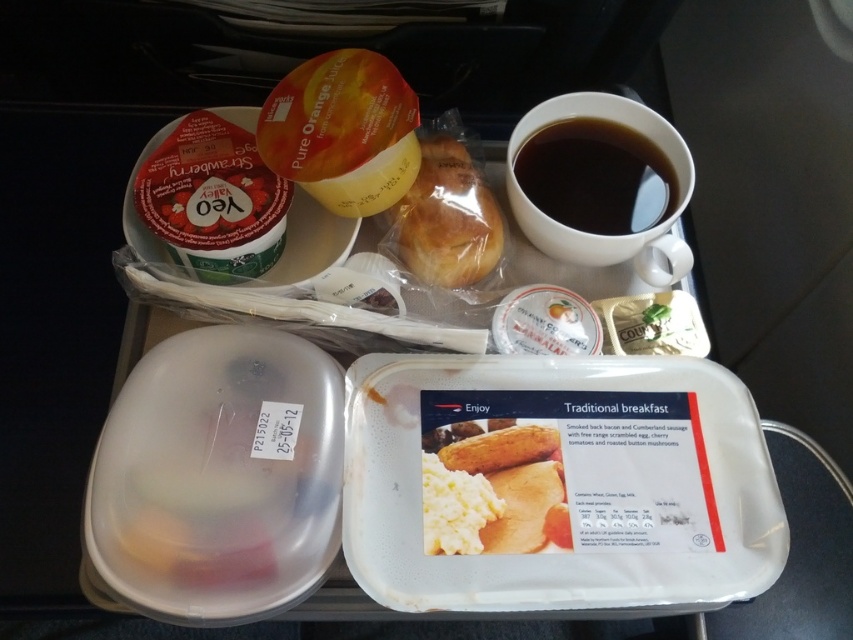
Question: Which of the following is the farthest from the observer?

Choices:
 (A) click(x=625, y=195)
 (B) click(x=431, y=468)

Answer: (A)

Question: Is black glossy cup at upper right to the left of golden brown bread at upper center from the viewer's perspective?

Choices:
 (A) no
 (B) yes

Answer: (A)

Question: Which of the following is the closest to the observer?

Choices:
 (A) (457, 144)
 (B) (457, 483)

Answer: (B)

Question: Which object is farther from the camera taking this photo?

Choices:
 (A) golden brown bread at upper center
 (B) white fluffy scrambled egg at center
 (C) black glossy cup at upper right

Answer: (C)

Question: Where is black glossy cup at upper right located in relation to golden brown bread at upper center in the image?

Choices:
 (A) right
 (B) left

Answer: (A)

Question: Can you confirm if white fluffy scrambled egg at center is bigger than golden brown bread at upper center?

Choices:
 (A) yes
 (B) no

Answer: (B)